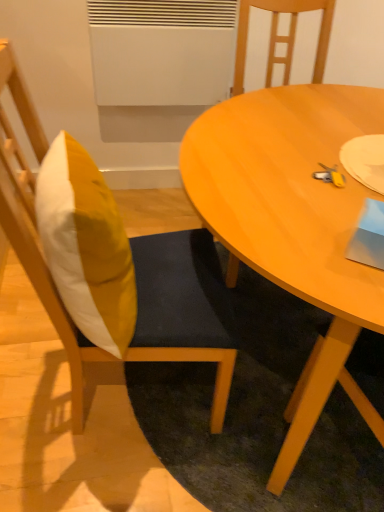
Question: In terms of height, does wooden chair at left, which appears as the first chair when viewed from the left, look taller or shorter compared to yellow fabric pillow at left?

Choices:
 (A) tall
 (B) short

Answer: (A)

Question: Considering their positions, is wooden chair at left, acting as the second chair starting from the right, located in front of or behind yellow fabric pillow at left?

Choices:
 (A) front
 (B) behind

Answer: (A)

Question: Which is nearer to the yellow fabric pillow at left?

Choices:
 (A) wooden chair at center, the second chair positioned from the left
 (B) wooden chair at left, which appears as the first chair when viewed from the left
 (C) light brown wooden table at center

Answer: (B)

Question: Which is farther from the wooden chair at center, the second chair positioned from the left?

Choices:
 (A) wooden chair at left, acting as the second chair starting from the right
 (B) light brown wooden table at center
 (C) yellow fabric pillow at left

Answer: (C)